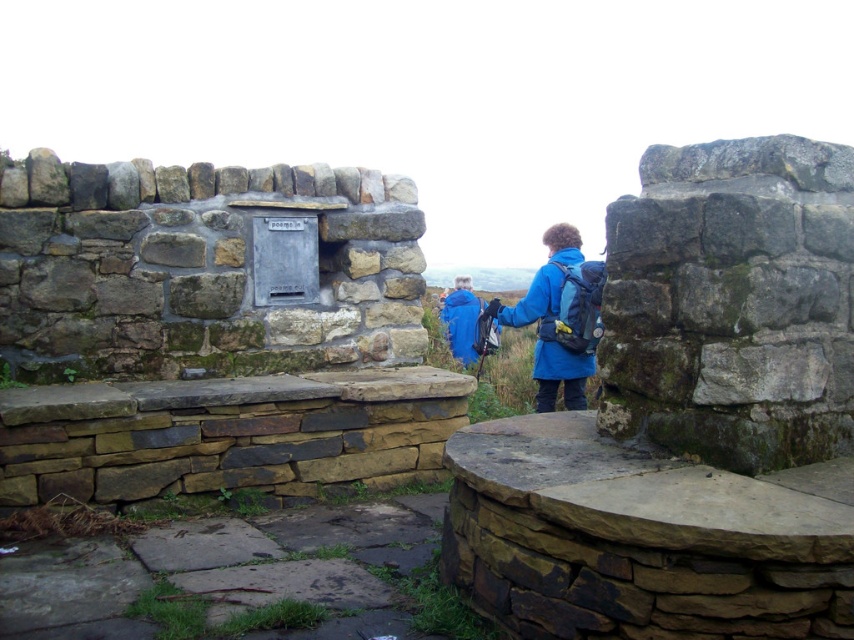
Question: Can you confirm if blue fabric jacket at center is positioned to the right of blue synthetic jacket at center?

Choices:
 (A) yes
 (B) no

Answer: (A)

Question: Which point is farther to the camera?

Choices:
 (A) blue fabric jacket at center
 (B) blue synthetic jacket at center

Answer: (B)

Question: Which of the following is the closest to the observer?

Choices:
 (A) (544, 298)
 (B) (469, 332)

Answer: (A)

Question: Where is blue fabric jacket at center located in relation to blue synthetic jacket at center in the image?

Choices:
 (A) right
 (B) left

Answer: (A)

Question: Is blue fabric jacket at center to the left of blue synthetic jacket at center from the viewer's perspective?

Choices:
 (A) no
 (B) yes

Answer: (A)